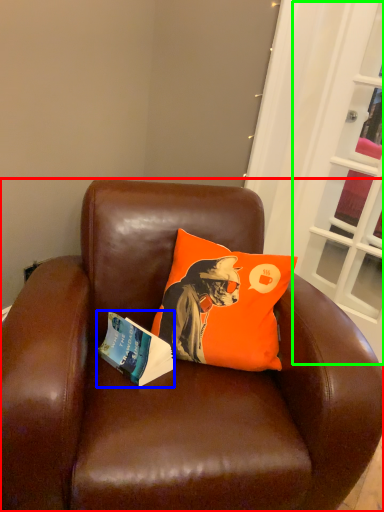
Question: Based on their relative distances, which object is farther from chair (highlighted by a red box)? Choose from book (highlighted by a blue box) and screen door (highlighted by a green box).

Choices:
 (A) book
 (B) screen door

Answer: (B)